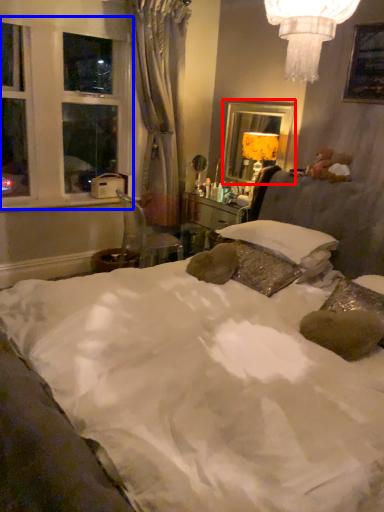
Question: Which of the following is the farthest to the observer, mirror (highlighted by a red box) or window frame (highlighted by a blue box)?

Choices:
 (A) mirror
 (B) window frame

Answer: (A)